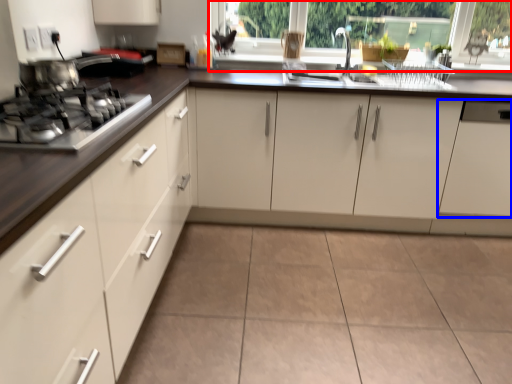
Question: Among these objects, which one is farthest to the camera, window frame (highlighted by a red box) or cabinetry (highlighted by a blue box)?

Choices:
 (A) window frame
 (B) cabinetry

Answer: (A)